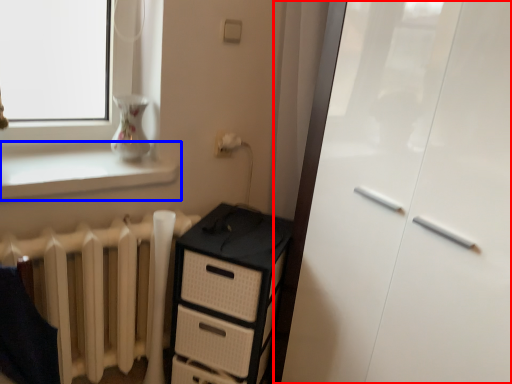
Question: Which object is closer to the camera taking this photo, screen door (highlighted by a red box) or window sill (highlighted by a blue box)?

Choices:
 (A) screen door
 (B) window sill

Answer: (A)